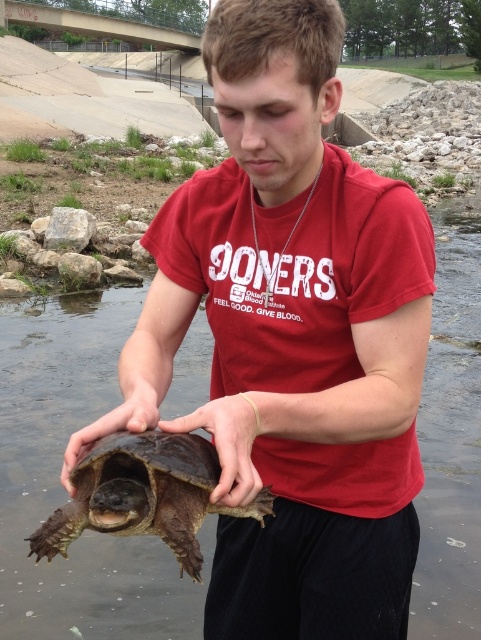
Question: Is brown rough turtle at center thinner than brown rough tortoise at center?

Choices:
 (A) no
 (B) yes

Answer: (A)

Question: Does brown rough tortoise at center have a lesser width compared to brown rough skin at center?

Choices:
 (A) no
 (B) yes

Answer: (A)

Question: Which is nearer to the matte brown turtle at center?

Choices:
 (A) brown rough tortoise at center
 (B) brown rough turtle at center

Answer: (A)

Question: Can you confirm if brown rough tortoise at center is positioned below matte brown turtle at center?

Choices:
 (A) no
 (B) yes

Answer: (B)

Question: Which object is the closest to the brown rough skin at center?

Choices:
 (A) brown rough tortoise at center
 (B) matte brown turtle at center

Answer: (A)

Question: Estimate the real-world distances between objects in this image. Which object is closer to the matte brown turtle at center?

Choices:
 (A) brown rough turtle at center
 (B) brown rough skin at center

Answer: (B)